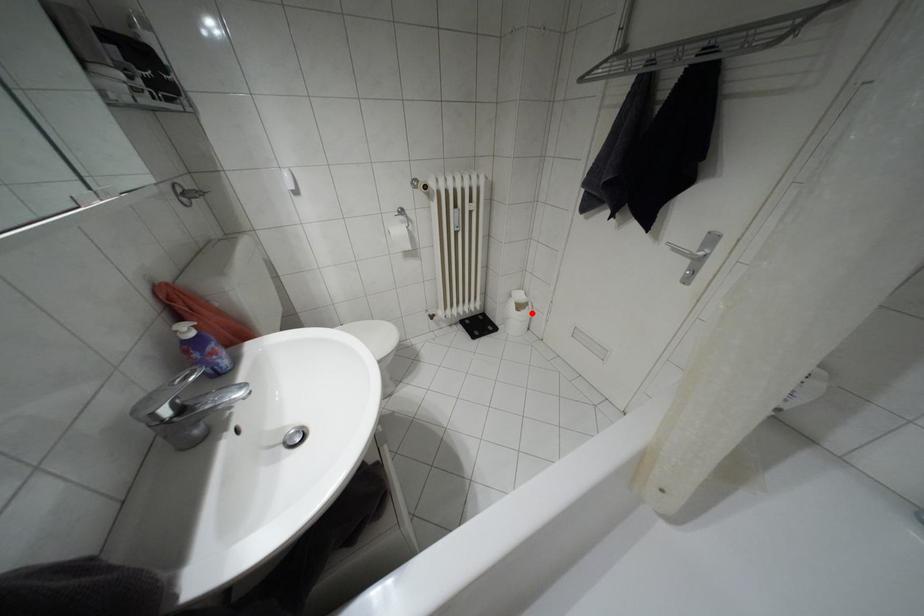
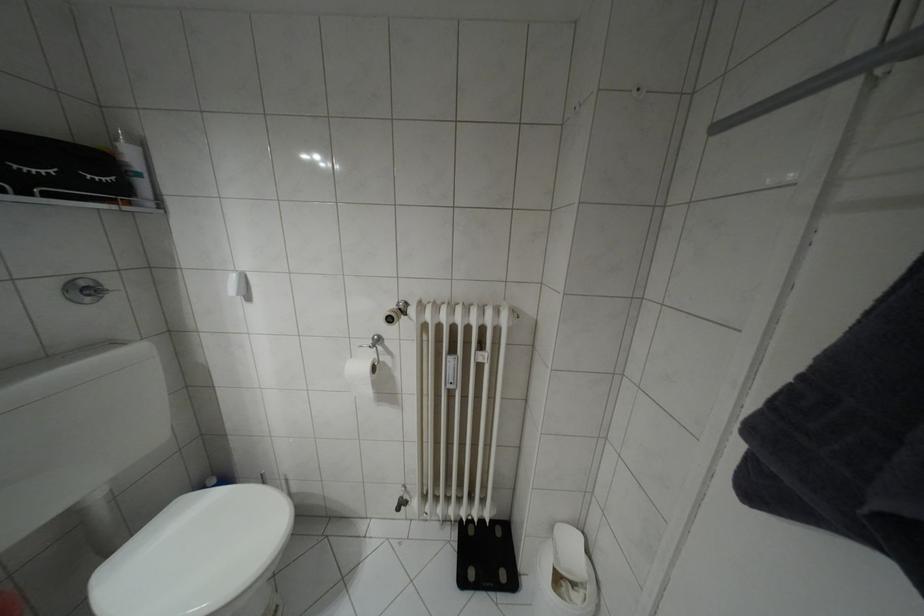
Find the pixel in the second image that matches the highlighted location in the first image.

(598, 606)